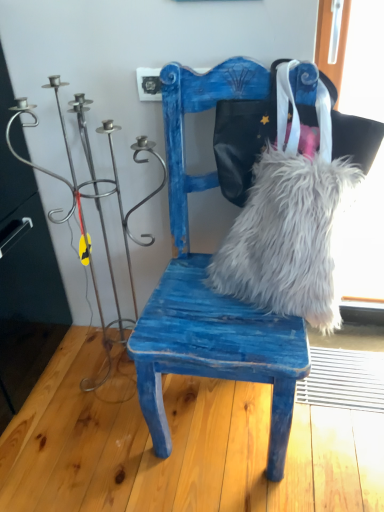
Question: Should I look upward or downward to see metallic wire candle holder at left?

Choices:
 (A) up
 (B) down

Answer: (A)

Question: From a real-world perspective, is blue distressed wood chair at center physically above white fluffy fur at center?

Choices:
 (A) yes
 (B) no

Answer: (A)

Question: Is blue distressed wood chair at center taller than white fluffy fur at center?

Choices:
 (A) yes
 (B) no

Answer: (A)

Question: Does blue distressed wood chair at center appear on the right side of white fluffy fur at center?

Choices:
 (A) yes
 (B) no

Answer: (B)

Question: Is blue distressed wood chair at center bigger than white fluffy fur at center?

Choices:
 (A) no
 (B) yes

Answer: (B)

Question: Is blue distressed wood chair at center outside of white fluffy fur at center?

Choices:
 (A) no
 (B) yes

Answer: (B)

Question: Is blue distressed wood chair at center at the left side of white fluffy fur at center?

Choices:
 (A) no
 (B) yes

Answer: (B)

Question: Is blue distressed wood chair at center at the back of white fluffy fur at center?

Choices:
 (A) no
 (B) yes

Answer: (B)

Question: Is blue distressed wood chair at center completely or partially inside white fluffy fur at center?

Choices:
 (A) yes
 (B) no

Answer: (B)

Question: Can you confirm if white fluffy fur at center is taller than blue distressed wood chair at center?

Choices:
 (A) no
 (B) yes

Answer: (A)

Question: Does white fluffy fur at center appear on the right side of blue distressed wood chair at center?

Choices:
 (A) yes
 (B) no

Answer: (A)

Question: Does white fluffy fur at center come behind blue distressed wood chair at center?

Choices:
 (A) yes
 (B) no

Answer: (A)

Question: Is white fluffy fur at center thinner than blue distressed wood chair at center?

Choices:
 (A) no
 (B) yes

Answer: (B)

Question: Does metallic wire candle holder at left have a lesser height compared to white fluffy fur at center?

Choices:
 (A) no
 (B) yes

Answer: (A)